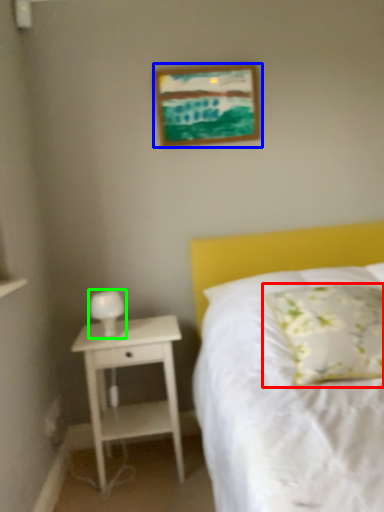
Question: Based on their relative distances, which object is nearer to pillow (highlighted by a red box)? Choose from picture frame (highlighted by a blue box) and bedside lamp (highlighted by a green box).

Choices:
 (A) picture frame
 (B) bedside lamp

Answer: (B)